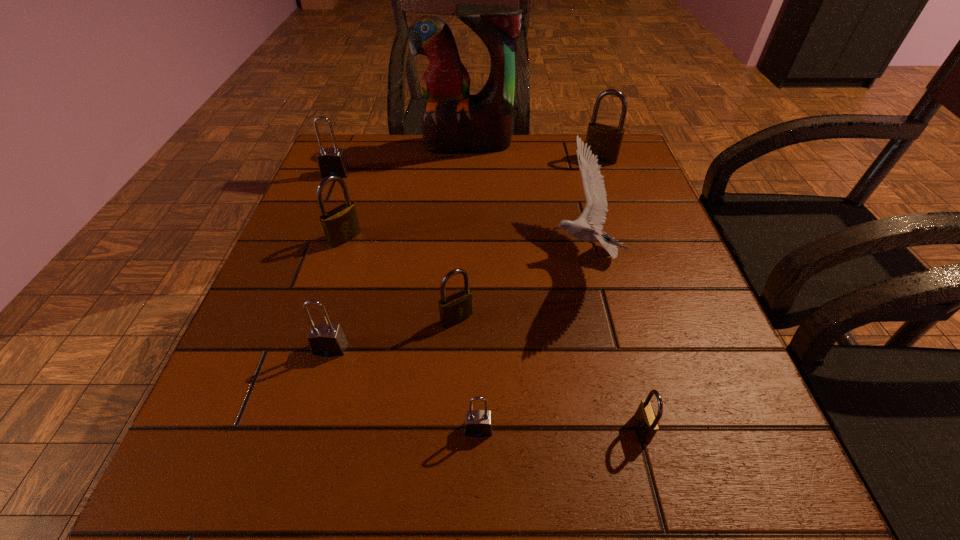
I want to click on object present at the far right corner, so click(605, 140).

The height and width of the screenshot is (540, 960). Identify the location of blank space at the far edge. (420, 144).

The width and height of the screenshot is (960, 540). In order to click on free region at the near edge of the desktop in this screenshot , I will do `click(313, 453)`.

The height and width of the screenshot is (540, 960). In order to click on vacant space at the left edge in this screenshot , I will do `click(342, 287)`.

In the image, there is a desktop. In order to click on vacant space at the right edge in this screenshot , I will do `click(629, 247)`.

This screenshot has height=540, width=960. I want to click on free space at the far left corner of the desktop, so coord(381,140).

At what (x,y) coordinates should I click in order to perform the action: click on vacant space at the far right corner of the desktop. Please return your answer as a coordinate pair (x, y). The image size is (960, 540). Looking at the image, I should click on (636, 166).

Locate an element on the screen. The width and height of the screenshot is (960, 540). blank region between the rightmost gray padlock and the second biggest gray padlock is located at coordinates (404, 389).

You are a GUI agent. You are given a task and a screenshot of the screen. Output one action in this format:
    pyautogui.click(x=<x>, y=<y>)
    Task: Click on the vacant space that's between the third farthest brass padlock and the white gull
    
    Given the screenshot: What is the action you would take?
    pyautogui.click(x=519, y=287)

You are a GUI agent. You are given a task and a screenshot of the screen. Output one action in this format:
    pyautogui.click(x=<x>, y=<y>)
    Task: Click on the vacant space in between the third farthest padlock and the white gull
    This screenshot has height=540, width=960.
    Given the screenshot: What is the action you would take?
    pyautogui.click(x=464, y=246)